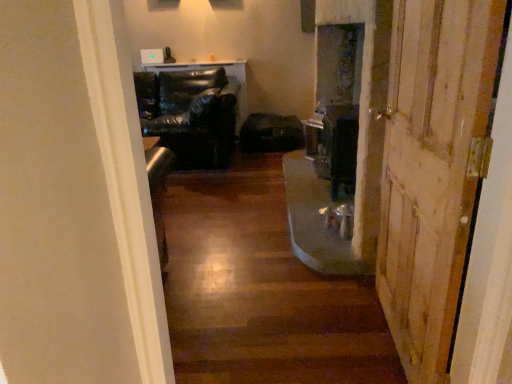
Locate an element on the screen. Image resolution: width=512 pixels, height=384 pixels. free point above wooden floor at center (from a real-world perspective) is located at coordinates (239, 223).